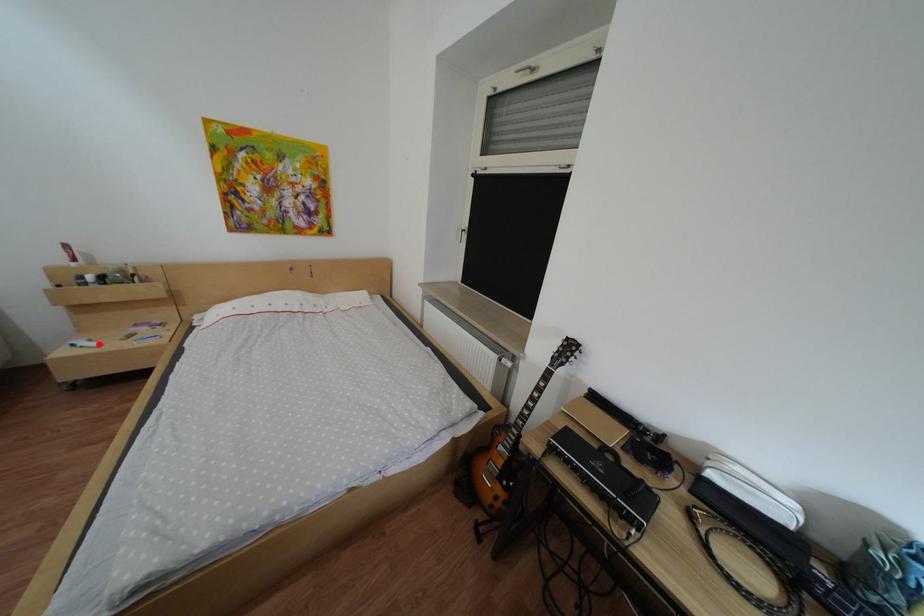
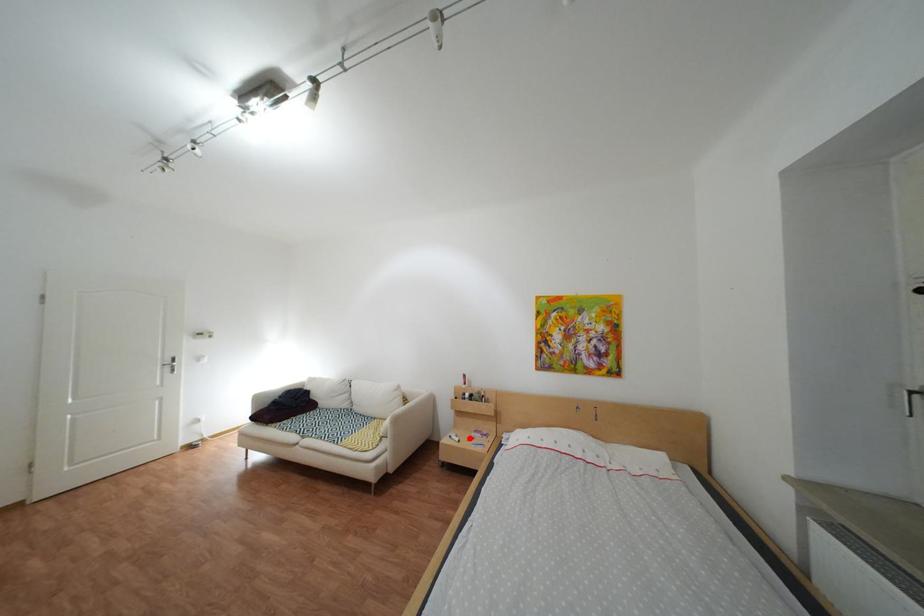
I am providing you with two images of the same scene from different viewpoints. A red point is marked on the first image and another point is marked on the second image. Is the marked point in image1 the same physical position as the marked point in image2?

Yes